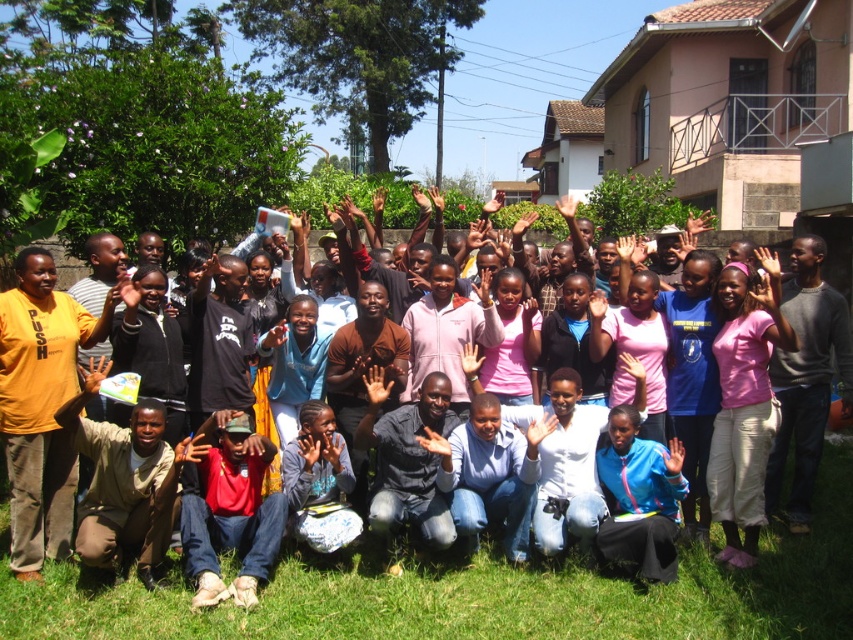
Which is behind, point (389, 387) or point (90, 360)?

Point (389, 387)

What do you see at coordinates (376, 385) in the screenshot? I see `smooth skin hand at center` at bounding box center [376, 385].

Locate an element on the screen. smooth skin hand at center is located at coordinates (376, 385).

Is point (440, 636) more distant than point (469, 376)?

No.

Who is more distant from viewer, (444, 580) or (473, 355)?

The point (473, 355) is more distant.

Where is `green grass at lower center`? Image resolution: width=853 pixels, height=640 pixels. green grass at lower center is located at coordinates (482, 595).

Between matte black shirt at center and pink cotton shirt at center, which one appears on the right side from the viewer's perspective?

From the viewer's perspective, pink cotton shirt at center appears more on the right side.

Who is more forward, (134,579) or (724,499)?

Positioned in front is point (134,579).

Who is more forward, (708,568) or (706,472)?

Point (708,568) is more forward.

Find the location of a particular element. matte black shirt at center is located at coordinates (x=480, y=593).